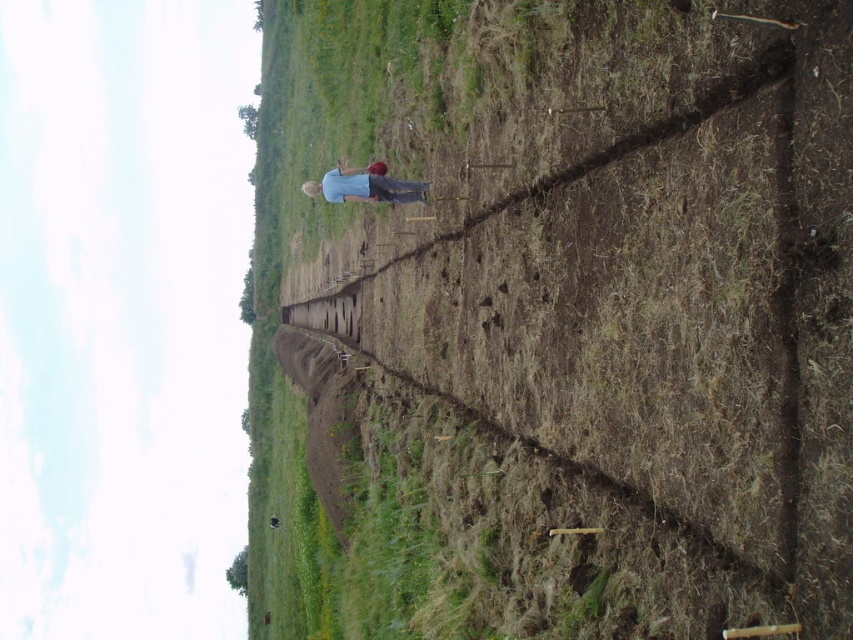
You are a farmer who needs to determine the space between the brown soil at center and the blue cotton shirt at center. Which one takes up more horizontal space in the image?

The brown soil at center has a larger width than the blue cotton shirt at center, so it takes up more horizontal space in the image.

You are a farmer standing at the edge of the field. You notice the brown soil at center and the blue cotton shirt at center. How far apart are these two items from each other?

The brown soil at center is 212.91 feet away from the blue cotton shirt at center.